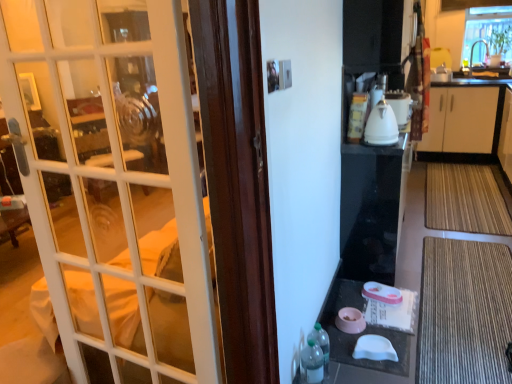
This screenshot has height=384, width=512. I want to click on brown textured mat at lower right, acting as the second doormat starting from the back, so click(464, 312).

Locate an element on the screen. The height and width of the screenshot is (384, 512). pink plastic table at lower center is located at coordinates (361, 332).

Find the location of a particular element. This screenshot has width=512, height=384. translucent plastic bottle at lower right, which is the first bottle from front to back is located at coordinates (312, 363).

Find the location of a particular element. The width and height of the screenshot is (512, 384). translucent plastic bottle at lower right, marked as the 2th bottle in a front-to-back arrangement is located at coordinates (321, 344).

The image size is (512, 384). There is a translucent plastic bottle at lower right, the 1th bottle positioned from the back. Find the location of `the 1st doormat below it (from a real-world perspective)`. the 1st doormat below it (from a real-world perspective) is located at coordinates (464, 312).

Can you confirm if brown textured mat at lower right, the second doormat positioned from the top, is shorter than translucent plastic bottle at lower right, the 1th bottle positioned from the back?

Yes, brown textured mat at lower right, the second doormat positioned from the top, is shorter than translucent plastic bottle at lower right, the 1th bottle positioned from the back.

Could you measure the distance between brown textured mat at lower right, acting as the second doormat starting from the back, and translucent plastic bottle at lower right, the 1th bottle positioned from the back?

32.62 inches.

Is brown textured mat at lower right, the second doormat positioned from the top, looking in the opposite direction of translucent plastic bottle at lower right, the 1th bottle positioned from the back?

No, brown textured mat at lower right, the second doormat positioned from the top,'s orientation is not away from translucent plastic bottle at lower right, the 1th bottle positioned from the back.

Between white glossy kettle at upper right and clear glass window at upper right, which one is positioned behind?

clear glass window at upper right is further from the camera.

From the image's perspective, between white glossy kettle at upper right and clear glass window at upper right, which one is located above?

clear glass window at upper right is shown above in the image.

What are the coordinates of `kitchen appliance below the clear glass window at upper right (from the image's perspective)` in the screenshot? It's located at (381, 125).

Who is bigger, clear glass window at upper right or pink plastic table at lower center?

clear glass window at upper right.

Which of these two, clear glass window at upper right or pink plastic table at lower center, is wider?

Wider between the two is pink plastic table at lower center.

Where is `window positioned vertically above the pink plastic table at lower center (from a real-world perspective)`? The width and height of the screenshot is (512, 384). window positioned vertically above the pink plastic table at lower center (from a real-world perspective) is located at coordinates (487, 33).

Which is less distant, (485,31) or (336,347)?

Point (485,31) is positioned farther from the camera compared to point (336,347).

From a real-world perspective, is clear glass window at upper right physically located above or below bamboo mat at lower right, placed as the 1th doormat when sorted from top to bottom?

Clearly, from a real-world perspective, clear glass window at upper right is above bamboo mat at lower right, placed as the 1th doormat when sorted from top to bottom.

Is clear glass window at upper right in front of bamboo mat at lower right, placed as the 1th doormat when sorted from top to bottom?

That is False.

Consider the image. What's the angular difference between clear glass window at upper right and bamboo mat at lower right, the 2th doormat in the front-to-back sequence,'s facing directions?

The angular difference between clear glass window at upper right and bamboo mat at lower right, the 2th doormat in the front-to-back sequence, is 0.754 degrees.

Who is taller, clear glass window at upper right or bamboo mat at lower right, placed as the 1th doormat when sorted from top to bottom?

Standing taller between the two is clear glass window at upper right.

Would you say bamboo mat at lower right, the 2th doormat in the front-to-back sequence, is outside clear glass window at upper right?

Yes.

From the image's perspective, which one is positioned lower, bamboo mat at lower right, placed as the 1th doormat when sorted from top to bottom, or clear glass window at upper right?

bamboo mat at lower right, placed as the 1th doormat when sorted from top to bottom, is shown below in the image.

Is bamboo mat at lower right, which appears as the second doormat when ordered from the bottom, facing towards pink plastic table at lower center?

Yes, bamboo mat at lower right, which appears as the second doormat when ordered from the bottom, faces towards pink plastic table at lower center.

Between bamboo mat at lower right, placed as the 1th doormat when sorted from top to bottom, and pink plastic table at lower center, which one has larger width?

bamboo mat at lower right, placed as the 1th doormat when sorted from top to bottom.

From a real-world perspective, who is located higher, bamboo mat at lower right, placed as the 1th doormat when sorted from top to bottom, or pink plastic table at lower center?

From a 3D spatial view, pink plastic table at lower center is above.

Is clear glass window at upper right beside white glass door at left?

They are not placed beside each other.

From the image's perspective, which is below, clear glass window at upper right or white glass door at left?

white glass door at left is shown below in the image.

Considering the relative positions of clear glass window at upper right and white glass door at left in the image provided, is clear glass window at upper right to the right of white glass door at left from the viewer's perspective?

Indeed, clear glass window at upper right is positioned on the right side of white glass door at left.

In the scene shown: Which point is more forward, (476, 25) or (106, 104)?

The point (106, 104) is in front.

Locate an element on the screen. The height and width of the screenshot is (384, 512). the 1st doormat to the right of the translucent plastic bottle at lower right, marked as the 2th bottle in a front-to-back arrangement, starting your count from the anchor is located at coordinates (464, 312).

Find the location of a particular element. The width and height of the screenshot is (512, 384). kitchen appliance on the left of clear glass window at upper right is located at coordinates (381, 125).

When comparing their distances from white glossy kettle at upper right, does translucent plastic bottle at lower right, the 2th bottle from the back, or bamboo mat at lower right, the 2th doormat in the front-to-back sequence, seem further?

translucent plastic bottle at lower right, the 2th bottle from the back.

Considering their positions, is white glass door at left positioned closer to pink plastic table at lower center than translucent plastic bottle at lower right, which is the first bottle from front to back?

translucent plastic bottle at lower right, which is the first bottle from front to back, is closer to pink plastic table at lower center.

Based on their spatial positions, is pink plastic table at lower center or bamboo mat at lower right, placed as the 1th doormat when sorted from top to bottom, closer to brown textured mat at lower right, the second doormat positioned from the top?

Among the two, pink plastic table at lower center is located nearer to brown textured mat at lower right, the second doormat positioned from the top.

When comparing their distances from bamboo mat at lower right, the 2th doormat in the front-to-back sequence, does white glossy kettle at upper right or translucent plastic bottle at lower right, the 1th bottle positioned from the back, seem further?

Based on the image, translucent plastic bottle at lower right, the 1th bottle positioned from the back, appears to be further to bamboo mat at lower right, the 2th doormat in the front-to-back sequence.

Considering their positions, is translucent plastic bottle at lower right, marked as the 2th bottle in a front-to-back arrangement, positioned further to bamboo mat at lower right, the 2th doormat in the front-to-back sequence, than pink plastic table at lower center?

→ Based on the image, translucent plastic bottle at lower right, marked as the 2th bottle in a front-to-back arrangement, appears to be further to bamboo mat at lower right, the 2th doormat in the front-to-back sequence.

Which object lies nearer to the anchor point brown textured mat at lower right, arranged as the first doormat when viewed from the front, translucent plastic bottle at lower right, marked as the 2th bottle in a front-to-back arrangement, or translucent plastic bottle at lower right, the 2th bottle from the back?

The object closer to brown textured mat at lower right, arranged as the first doormat when viewed from the front, is translucent plastic bottle at lower right, marked as the 2th bottle in a front-to-back arrangement.

Which object lies further to the anchor point pink plastic table at lower center, brown textured mat at lower right, acting as the second doormat starting from the back, or white glossy kettle at upper right?

white glossy kettle at upper right is positioned further to the anchor pink plastic table at lower center.

Considering their positions, is white glossy kettle at upper right positioned further to white glossy kettle at upper right than clear glass window at upper right?

clear glass window at upper right lies further to white glossy kettle at upper right than the other object.

Where is `bottle located between translucent plastic bottle at lower right, the 2th bottle from the back, and bamboo mat at lower right, the 2th doormat in the front-to-back sequence, in the left-right direction`? bottle located between translucent plastic bottle at lower right, the 2th bottle from the back, and bamboo mat at lower right, the 2th doormat in the front-to-back sequence, in the left-right direction is located at coordinates (321, 344).

At what (x,y) coordinates should I click in order to perform the action: click on bottle situated between translucent plastic bottle at lower right, the 2th bottle from the back, and brown textured mat at lower right, acting as the second doormat starting from the back, from left to right. Please return your answer as a coordinate pair (x, y). Looking at the image, I should click on (321, 344).

Locate an element on the screen. table situated between white glass door at left and bamboo mat at lower right, which appears as the second doormat when ordered from the bottom, from left to right is located at coordinates (361, 332).

Locate an element on the screen. This screenshot has height=384, width=512. kitchen appliance between pink plastic table at lower center and clear glass window at upper right in the front-back direction is located at coordinates (381, 125).